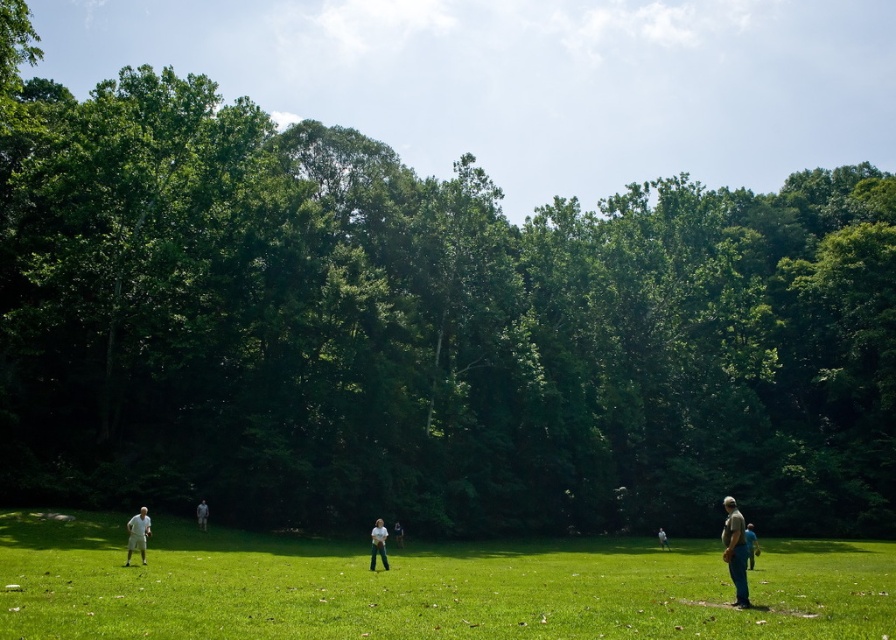
Question: Is light brown leather jacket at lower right wider than white cotton shirt at lower right?

Choices:
 (A) no
 (B) yes

Answer: (B)

Question: From the image, what is the correct spatial relationship of green grassy field at lower center in relation to blue fabric shirt at right?

Choices:
 (A) below
 (B) above

Answer: (B)

Question: Is white fabric person at center further to the viewer compared to white cotton shirt at lower right?

Choices:
 (A) no
 (B) yes

Answer: (A)

Question: Among these points, which one is farthest from the camera?

Choices:
 (A) (386, 563)
 (B) (197, 515)
 (C) (737, 552)

Answer: (B)

Question: Which point appears closest to the camera in this image?

Choices:
 (A) (130, 538)
 (B) (662, 532)
 (C) (871, 582)
 (D) (751, 563)

Answer: (D)

Question: Estimate the real-world distances between objects in this image. Which object is closer to the white fabric shirt at center?

Choices:
 (A) green grassy field at lower center
 (B) blue fabric shirt at right
 (C) light brown leather jacket at lower right

Answer: (A)